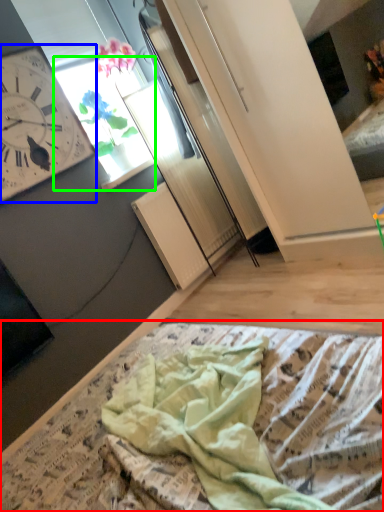
Question: Which object is positioned closest to blanket (highlighted by a red box)? Select from wall clock (highlighted by a blue box) and window (highlighted by a green box).

Choices:
 (A) wall clock
 (B) window

Answer: (A)